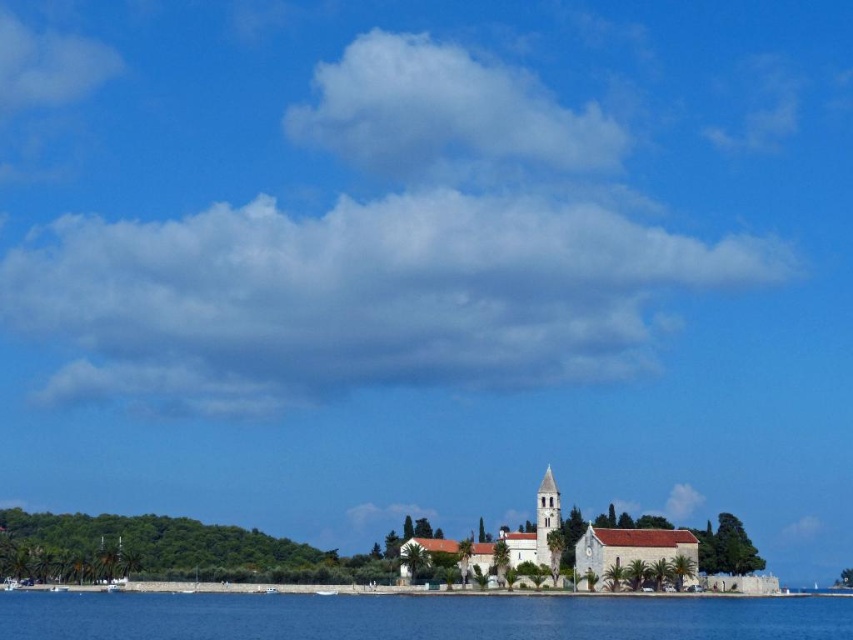
Does blue water at lower center appear on the right side of white stone spire at center?

Incorrect, blue water at lower center is not on the right side of white stone spire at center.

Does blue water at lower center have a larger size compared to white stone spire at center?

Yes.

Is point (589, 609) in front of point (537, 499)?

Yes, it is.

This screenshot has width=853, height=640. Find the location of `blue water at lower center`. blue water at lower center is located at coordinates (x=418, y=616).

Can you confirm if blue water at lower center is positioned to the right of white stone church at center?

Incorrect, blue water at lower center is not on the right side of white stone church at center.

Which is in front, point (444, 637) or point (680, 550)?

Point (444, 637)

Who is more forward, [248,612] or [676,554]?

Point [248,612]

You are a GUI agent. You are given a task and a screenshot of the screen. Output one action in this format:
    pyautogui.click(x=<x>, y=<y>)
    Task: Click on the blue water at lower center
    The width and height of the screenshot is (853, 640).
    Given the screenshot: What is the action you would take?
    pyautogui.click(x=418, y=616)

This screenshot has height=640, width=853. Describe the element at coordinates (631, 548) in the screenshot. I see `white stone church at center` at that location.

Who is more forward, [611,540] or [544,499]?

Point [611,540]

I want to click on white stone church at center, so click(631, 548).